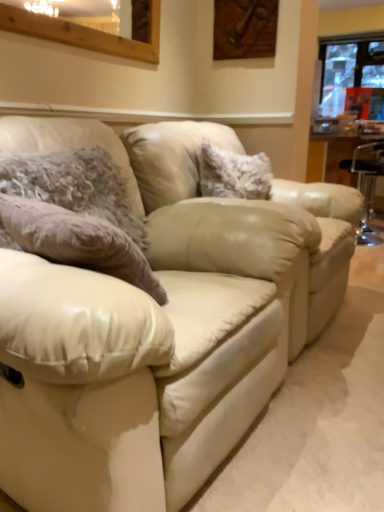
Question: Considering the positions of point click(24, 19) and point click(34, 467), is point click(24, 19) closer or farther from the camera than point click(34, 467)?

Choices:
 (A) farther
 (B) closer

Answer: (A)

Question: From a real-world perspective, relative to matte cream leather couch at center, is wooden frame at upper left, positioned as the 1th window in front-to-back order, vertically above or below?

Choices:
 (A) below
 (B) above

Answer: (B)

Question: Which is farther from the matte cream leather couch at center?

Choices:
 (A) transparent plastic bar stool at right
 (B) fuzzy fabric pillow at center, acting as the first pillow starting from the right
 (C) wooden frame at upper left, positioned as the 1th window in left-to-right order
 (D) beige leather swivel chair at center
 (E) transparent glass window at upper right, marked as the first window in a back-to-front arrangement

Answer: (E)

Question: Estimate the real-world distances between objects in this image. Which object is farther from the fuzzy fabric pillow at left, arranged as the 1th pillow when viewed from the front?

Choices:
 (A) transparent glass window at upper right, the second window from the bottom
 (B) transparent plastic bar stool at right
 (C) fuzzy fabric pillow at center, which appears as the 1th pillow when viewed from the back
 (D) wooden frame at upper left, the first window from the bottom
 (E) matte cream leather couch at center

Answer: (A)